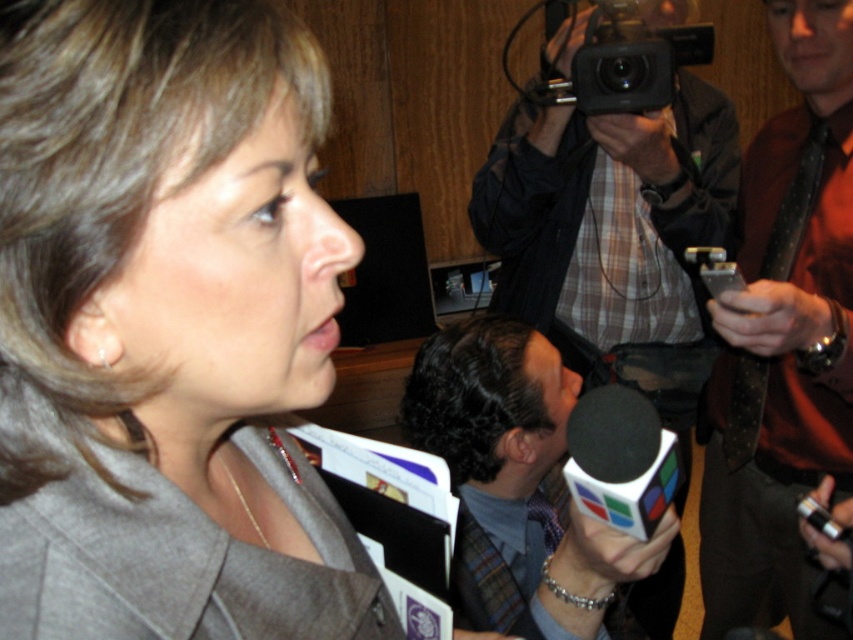
Which is more to the left, polka dot tie at right or black plastic camera at upper center?

black plastic camera at upper center is more to the left.

Between polka dot tie at right and black plastic camera at upper center, which one is positioned higher?

Positioned higher is black plastic camera at upper center.

Does point (732, 321) come behind point (590, 22)?

No, (732, 321) is in front of (590, 22).

Where is `polka dot tie at right`? polka dot tie at right is located at coordinates (785, 346).

Image resolution: width=853 pixels, height=640 pixels. Identify the location of polka dot tie at right. (785, 346).

Between polka dot tie at right and plaid shirt at upper center, which one appears on the right side from the viewer's perspective?

From the viewer's perspective, polka dot tie at right appears more on the right side.

Is point (793, 116) positioned after point (553, 44)?

Yes, it is.

Where is `polka dot tie at right`? polka dot tie at right is located at coordinates (785, 346).

How much distance is there between plaid shirt at upper center and plaid fabric tie at center?

They are 21.04 inches apart.

Is plaid shirt at upper center to the left of plaid fabric tie at center from the viewer's perspective?

No, plaid shirt at upper center is not to the left of plaid fabric tie at center.

Between point (567, 42) and point (618, 614), which one is positioned in front?

Point (618, 614)

Locate an element on the screen. plaid shirt at upper center is located at coordinates (613, 236).